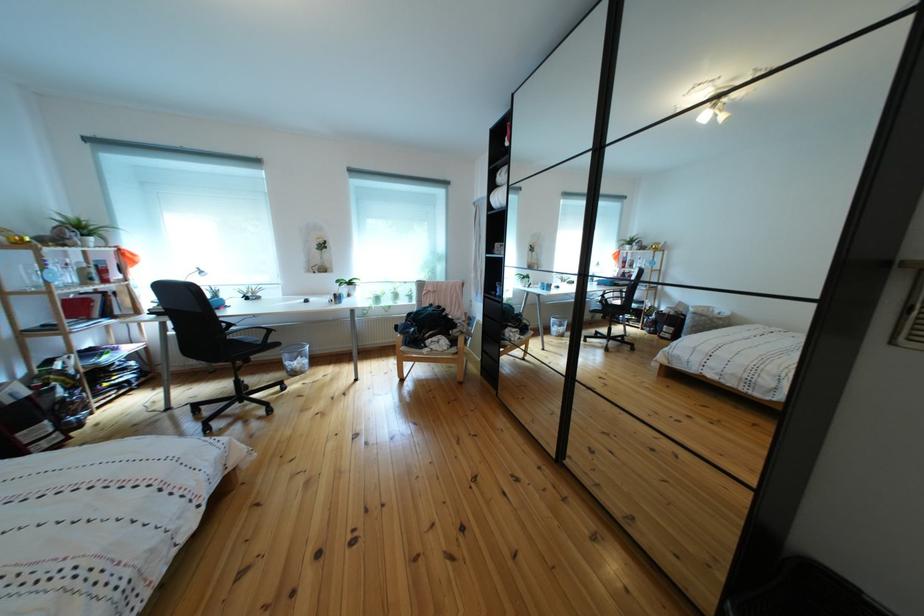
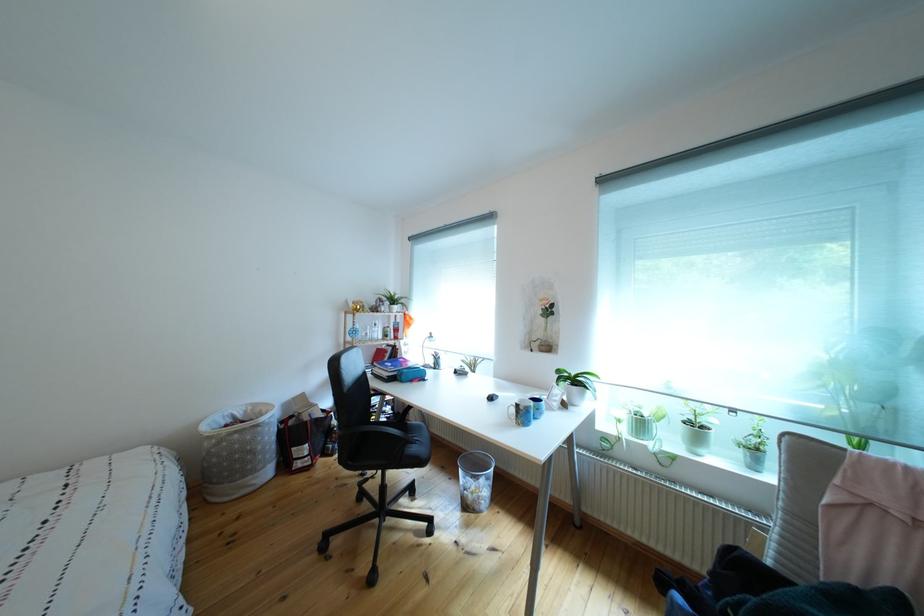
Locate, in the second image, the point that corresponds to the point at 73,399 in the first image.

(346, 428)